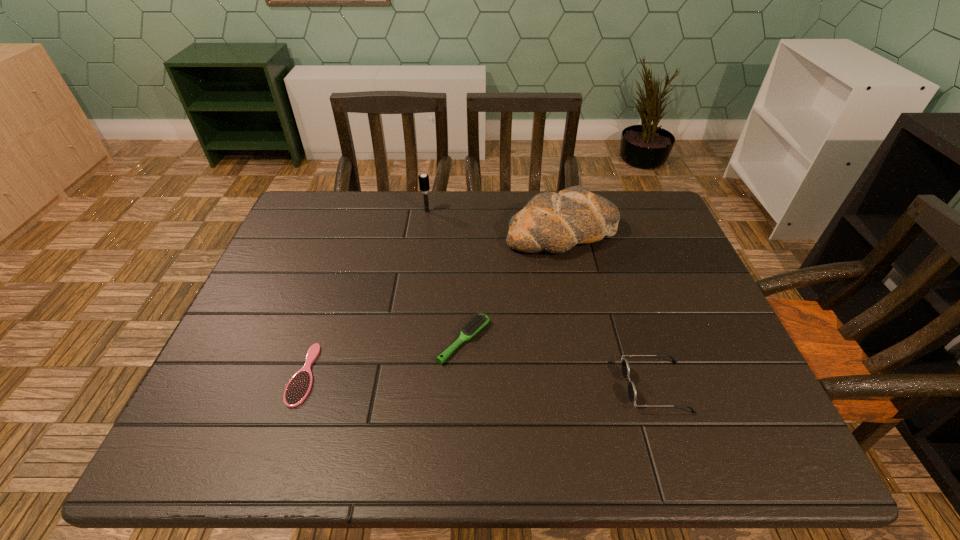
Where is `empty space between the second hairbrush from left to right and the sunglasses`? This screenshot has width=960, height=540. empty space between the second hairbrush from left to right and the sunglasses is located at coordinates (541, 299).

This screenshot has height=540, width=960. What are the coordinates of `vacant space that is in between the second tallest hairbrush and the third shortest object` in the screenshot? It's located at (560, 363).

I want to click on empty location between the sunglasses and the third object from right to left, so click(x=560, y=363).

Identify the location of vacant space that is in between the sunglasses and the third object from right to left. Image resolution: width=960 pixels, height=540 pixels. (560, 363).

Identify which object is the second closest to the farthest hairbrush. Please provide its 2D coordinates. Your answer should be formatted as a tuple, i.e. [(x, y)], where the tuple contains the x and y coordinates of a point satisfying the conditions above.

[(477, 322)]

This screenshot has width=960, height=540. In order to click on the second closest object relative to the shortest hairbrush in this screenshot , I will do tap(555, 222).

Identify which hairbrush is the second closest to the tallest hairbrush. Please provide its 2D coordinates. Your answer should be formatted as a tuple, i.e. [(x, y)], where the tuple contains the x and y coordinates of a point satisfying the conditions above.

[(298, 388)]

I want to click on hairbrush identified as the third closest to the third shortest object, so click(x=424, y=183).

Identify the location of vacant space that satisfies the following two spatial constraints: 1. on the back side of the shortest hairbrush; 2. on the left side of the tallest hairbrush. (358, 212).

Find the location of a particular element. Image resolution: width=960 pixels, height=540 pixels. free region that satisfies the following two spatial constraints: 1. on the front side of the farthest hairbrush; 2. on the left side of the bread is located at coordinates (423, 233).